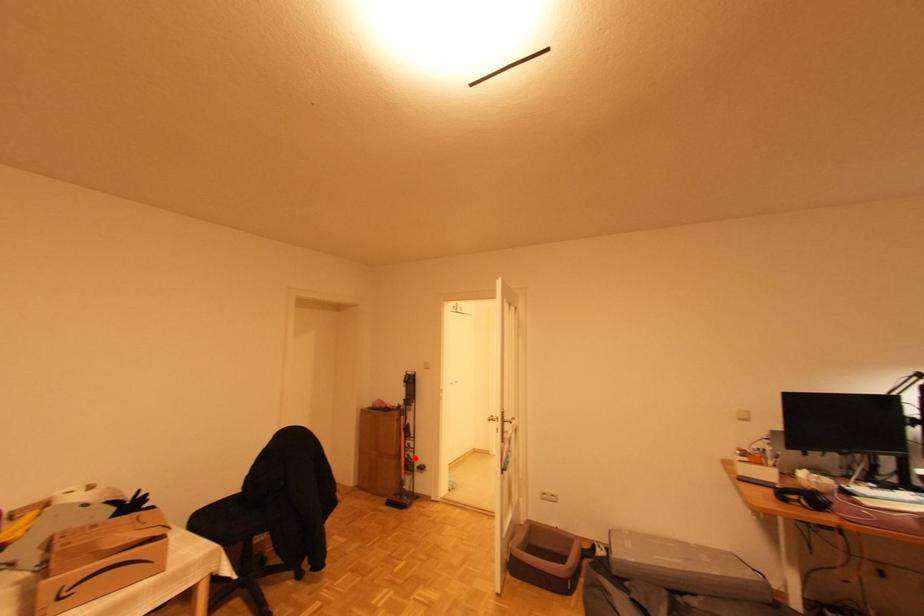
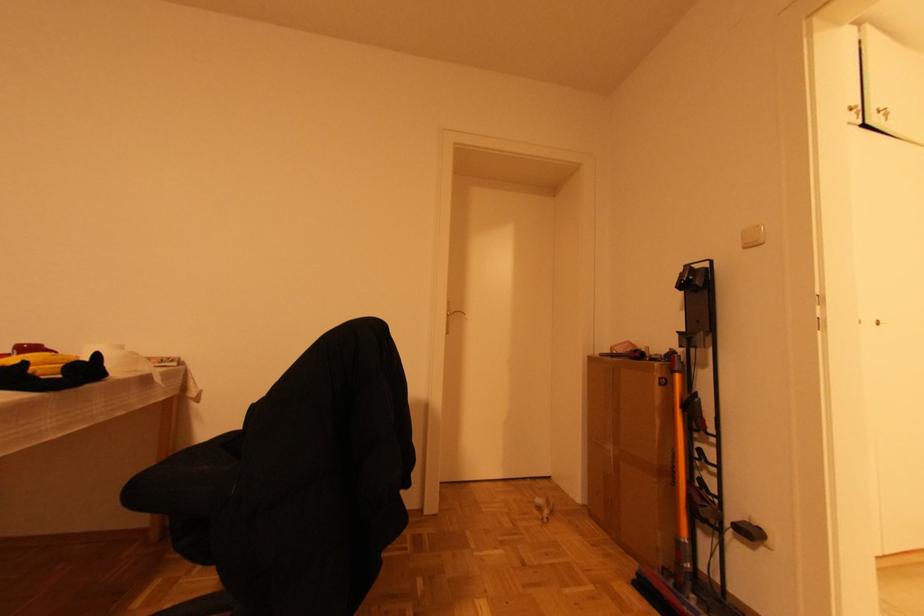
Question: I am providing you with two images of the same scene from different viewpoints. A red point is shown in image1. For the corresponding object point in image2, is it positioned nearer or farther from the camera?

Choices:
 (A) Nearer
 (B) Farther

Answer: (A)